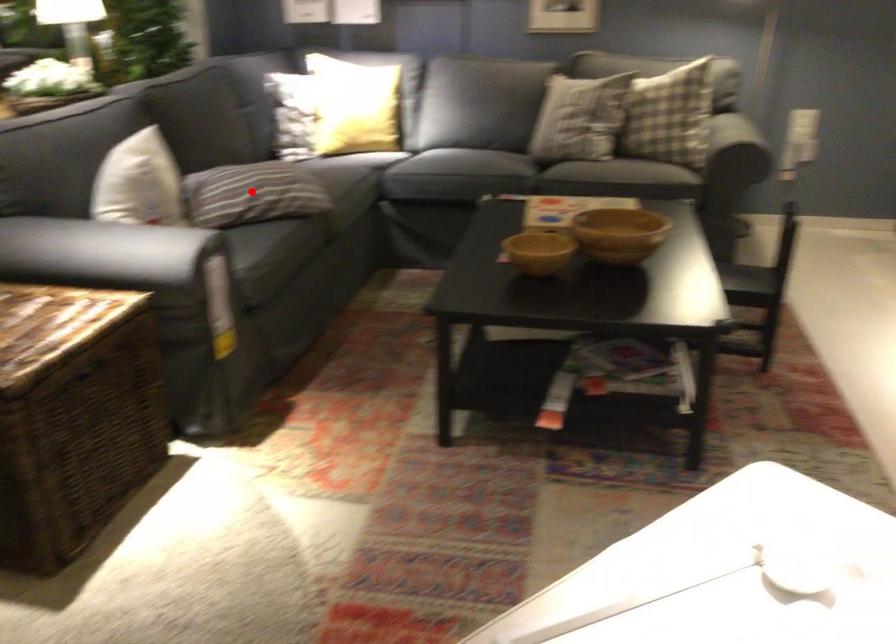
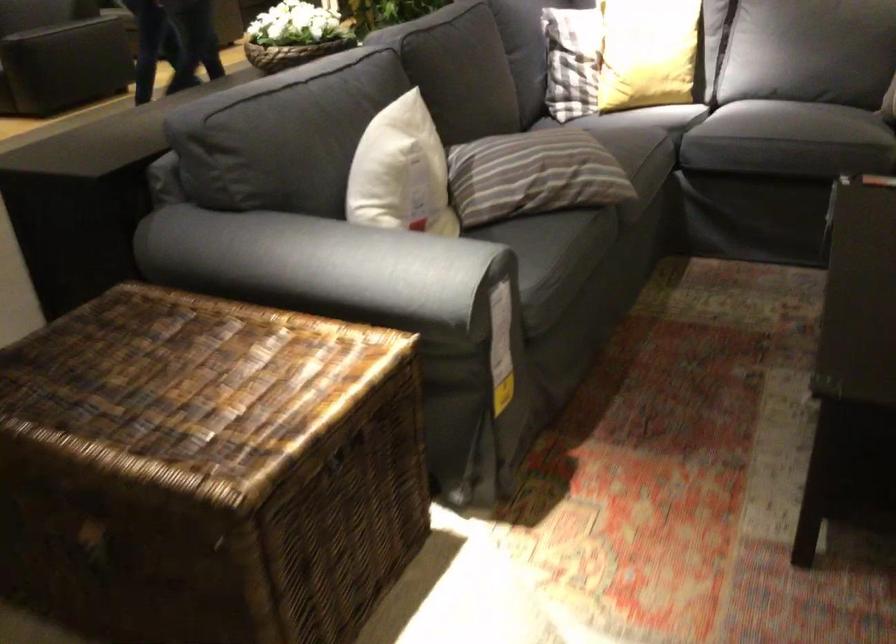
Where in the second image is the point corresponding to the highlighted location from the first image?

(533, 174)